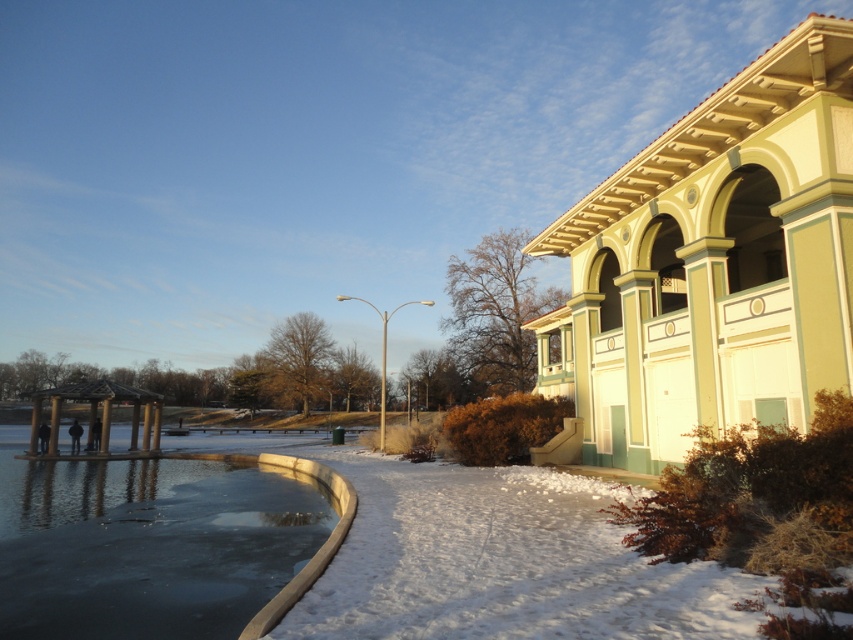
Looking at this image, you are standing at the center of the park and want to take a photo of the classical building with the wooden gazebo in the background. Where should you place your feet to ensure the white fluffy snow at lower center is not in the frame?

To avoid including the white fluffy snow at lower center in your photo, you should position your feet away from the coordinates specified at point (502, 561) where the snow is located.

You are standing in the winter scene and want to walk to the smooth concrete lake at lower left. Which direction should you move relative to the white fluffy snow at lower center?

Since the white fluffy snow at lower center is closer to the viewer than the smooth concrete lake at lower left, you should move away from the white fluffy snow at lower center to reach the smooth concrete lake at lower left.